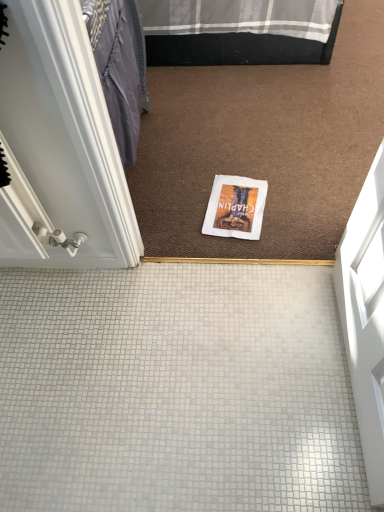
Question: From a real-world perspective, does white glossy door at left stand above white paper magazine at center?

Choices:
 (A) no
 (B) yes

Answer: (B)

Question: Is white glossy door at left positioned with its back to white paper magazine at center?

Choices:
 (A) no
 (B) yes

Answer: (A)

Question: Is white glossy door at left closer to the viewer compared to white paper magazine at center?

Choices:
 (A) no
 (B) yes

Answer: (B)

Question: Considering the relative sizes of white glossy door at left and white paper magazine at center in the image provided, is white glossy door at left bigger than white paper magazine at center?

Choices:
 (A) no
 (B) yes

Answer: (B)

Question: From the image's perspective, does white glossy door at left appear lower than white paper magazine at center?

Choices:
 (A) no
 (B) yes

Answer: (A)

Question: Considering the relative sizes of white glossy door at left and white paper magazine at center in the image provided, is white glossy door at left wider than white paper magazine at center?

Choices:
 (A) no
 (B) yes

Answer: (B)

Question: Is white paper magazine at center at the left side of white tile floor at center?

Choices:
 (A) no
 (B) yes

Answer: (A)

Question: Is white paper magazine at center wider than white tile floor at center?

Choices:
 (A) yes
 (B) no

Answer: (B)

Question: Considering the relative positions of white paper magazine at center and white tile floor at center in the image provided, is white paper magazine at center in front of white tile floor at center?

Choices:
 (A) no
 (B) yes

Answer: (A)

Question: From the image's perspective, is white paper magazine at center below white tile floor at center?

Choices:
 (A) yes
 (B) no

Answer: (B)

Question: Is white paper magazine at center with white tile floor at center?

Choices:
 (A) no
 (B) yes

Answer: (A)

Question: From a real-world perspective, is white paper magazine at center over white tile floor at center?

Choices:
 (A) yes
 (B) no

Answer: (A)

Question: Can you confirm if white tile floor at center is positioned to the right of white paper magazine at center?

Choices:
 (A) yes
 (B) no

Answer: (B)